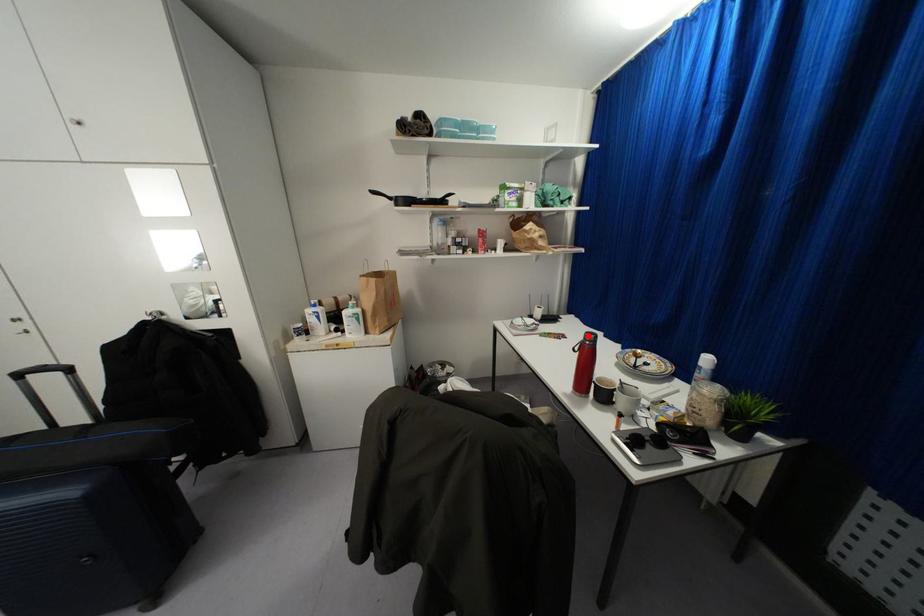
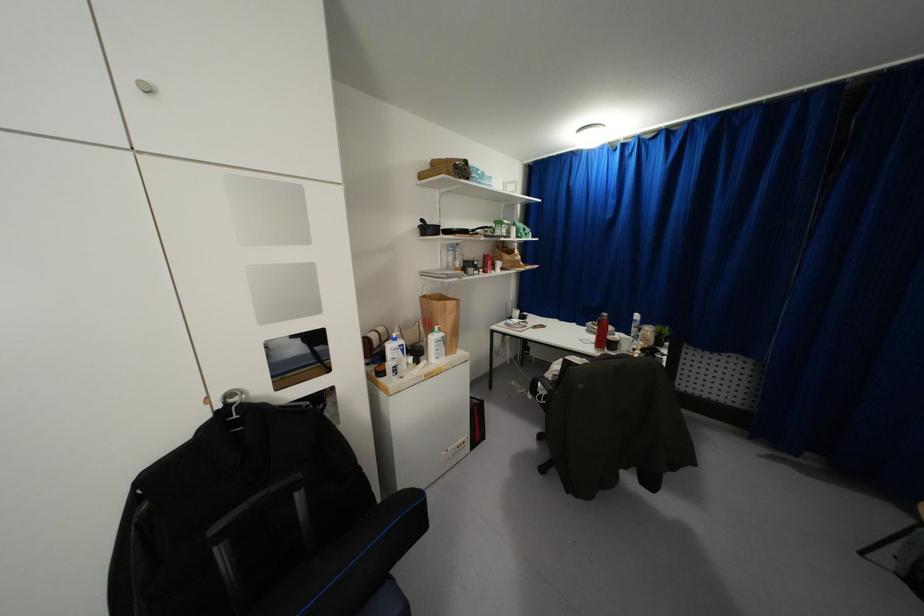
Find the pixel in the second image that matches the highlighted location in the first image.

(603, 314)